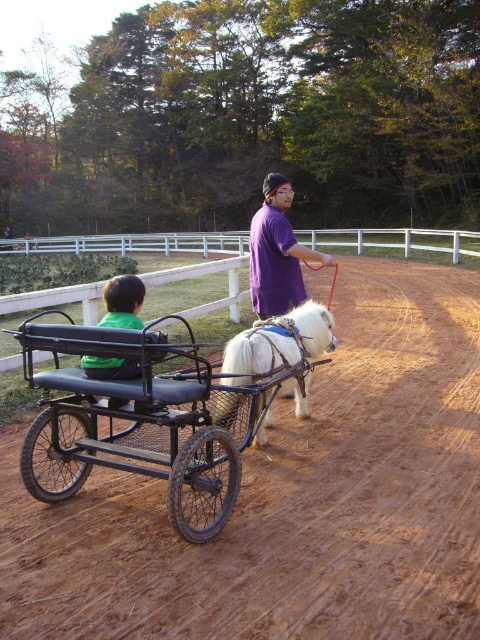
Between black rubber wagon at center and white soft fur horse at center, which one has less height?

Standing shorter between the two is white soft fur horse at center.

Is point (36, 436) in front of point (232, 396)?

That is True.

This screenshot has height=640, width=480. In order to click on black rubber wagon at center in this screenshot , I will do `click(152, 412)`.

Is brown dirt field at center further to the viewer compared to green matte shirt at center?

No, brown dirt field at center is closer to the viewer.

Measure the distance between brown dirt field at center and camera.

brown dirt field at center is 2.05 meters from camera.

Does point (264, 632) lie behind point (120, 365)?

No, (264, 632) is in front of (120, 365).

At what (x,y) coordinates should I click in order to perform the action: click on brown dirt field at center. Please return your answer as a coordinate pair (x, y). The height and width of the screenshot is (640, 480). Looking at the image, I should click on (291, 500).

Is white soft fur horse at center positioned at the back of purple matte shirt at center?

No, it is in front of purple matte shirt at center.

Which of these two, white soft fur horse at center or purple matte shirt at center, stands taller?

Standing taller between the two is purple matte shirt at center.

Which is in front, point (216, 419) or point (289, 300)?

Point (216, 419)

I want to click on white soft fur horse at center, so click(278, 342).